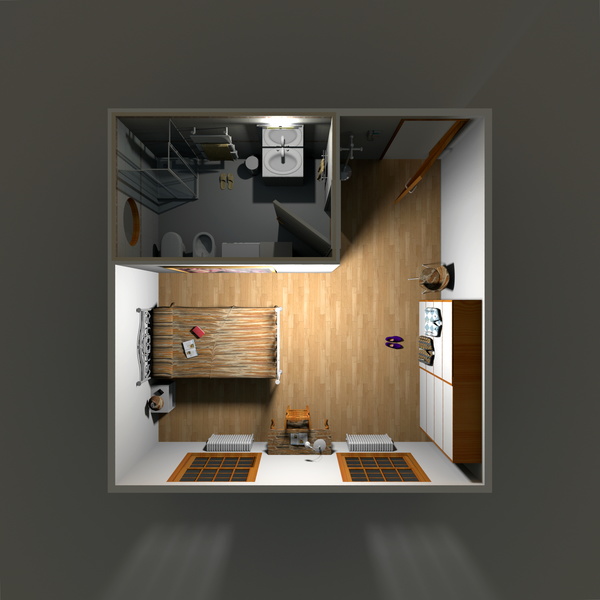
Identify the location of shower. (180, 170), (180, 152), (161, 183), (145, 182).